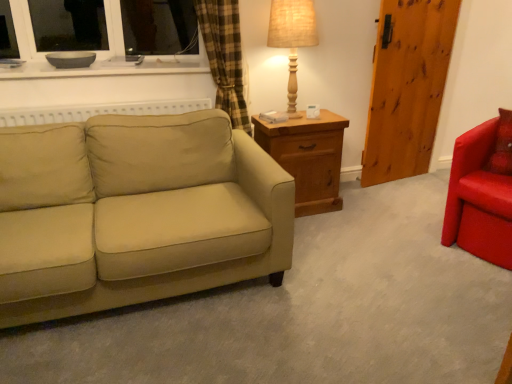
Find the location of a particular element. vacant area that lies between shiny red armchair at right and beige fabric couch at left is located at coordinates (343, 261).